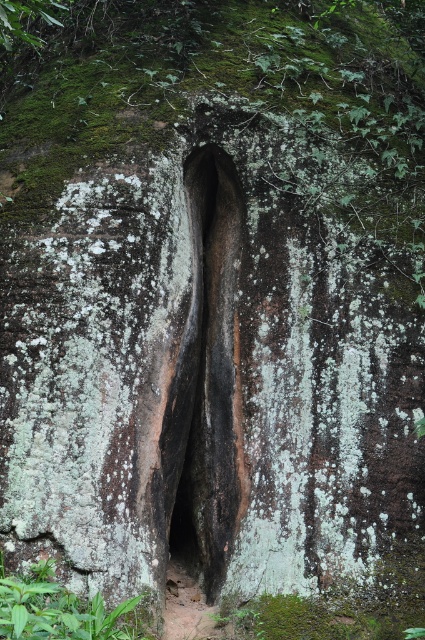
Question: Is black rock cave at center to the right of green leafy plant at lower left from the viewer's perspective?

Choices:
 (A) yes
 (B) no

Answer: (A)

Question: Estimate the real-world distances between objects in this image. Which object is closer to the green mossy leaves at center?

Choices:
 (A) black rock cave at center
 (B) green leafy plant at lower left

Answer: (A)

Question: Which object is positioned closest to the black rock cave at center?

Choices:
 (A) green leafy plant at lower left
 (B) green mossy leaves at center

Answer: (B)

Question: Can you confirm if green mossy leaves at center is wider than green leafy plant at lower left?

Choices:
 (A) yes
 (B) no

Answer: (A)

Question: Which point is closer to the camera taking this photo?

Choices:
 (A) 232,490
 (B) 215,24
 (C) 37,568

Answer: (C)

Question: Is black rock cave at center to the right of green leafy plant at lower left from the viewer's perspective?

Choices:
 (A) no
 (B) yes

Answer: (B)